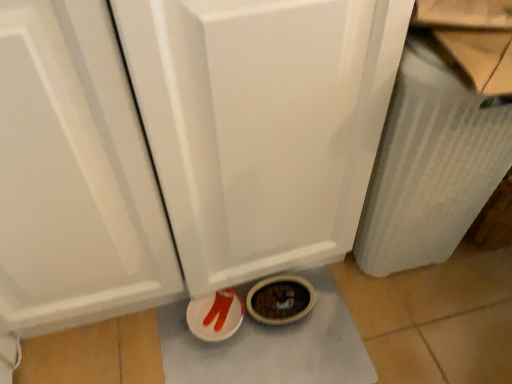
Question: Does white textured radiator at right have a lesser height compared to white textured bath mat at lower center?

Choices:
 (A) no
 (B) yes

Answer: (A)

Question: Considering the relative sizes of white textured radiator at right and white textured bath mat at lower center in the image provided, is white textured radiator at right wider than white textured bath mat at lower center?

Choices:
 (A) yes
 (B) no

Answer: (B)

Question: Does white textured radiator at right appear on the left side of white textured bath mat at lower center?

Choices:
 (A) no
 (B) yes

Answer: (A)

Question: From the image's perspective, does white textured radiator at right appear lower than white textured bath mat at lower center?

Choices:
 (A) yes
 (B) no

Answer: (B)

Question: Considering the relative sizes of white textured radiator at right and white textured bath mat at lower center in the image provided, is white textured radiator at right taller than white textured bath mat at lower center?

Choices:
 (A) yes
 (B) no

Answer: (A)

Question: Would you say white textured radiator at right contains white textured bath mat at lower center?

Choices:
 (A) yes
 (B) no

Answer: (B)

Question: Considering the relative sizes of matte plastic shoes at lower center and white textured bath mat at lower center in the image provided, is matte plastic shoes at lower center thinner than white textured bath mat at lower center?

Choices:
 (A) no
 (B) yes

Answer: (B)

Question: Is the depth of matte plastic shoes at lower center less than that of white textured bath mat at lower center?

Choices:
 (A) no
 (B) yes

Answer: (A)

Question: Considering the relative sizes of matte plastic shoes at lower center and white textured bath mat at lower center in the image provided, is matte plastic shoes at lower center bigger than white textured bath mat at lower center?

Choices:
 (A) no
 (B) yes

Answer: (A)

Question: Does matte plastic shoes at lower center lie behind white textured bath mat at lower center?

Choices:
 (A) yes
 (B) no

Answer: (A)

Question: From a real-world perspective, is matte plastic shoes at lower center over white textured bath mat at lower center?

Choices:
 (A) yes
 (B) no

Answer: (A)

Question: Does matte plastic shoes at lower center have a smaller size compared to white textured bath mat at lower center?

Choices:
 (A) yes
 (B) no

Answer: (A)

Question: Does white textured bath mat at lower center have a greater width compared to white textured radiator at right?

Choices:
 (A) no
 (B) yes

Answer: (B)